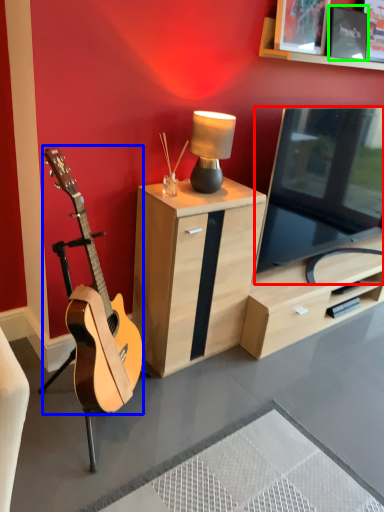
Question: Which is nearer to the television (highlighted by a red box)? guitar (highlighted by a blue box) or picture frame (highlighted by a green box).

Choices:
 (A) guitar
 (B) picture frame

Answer: (B)